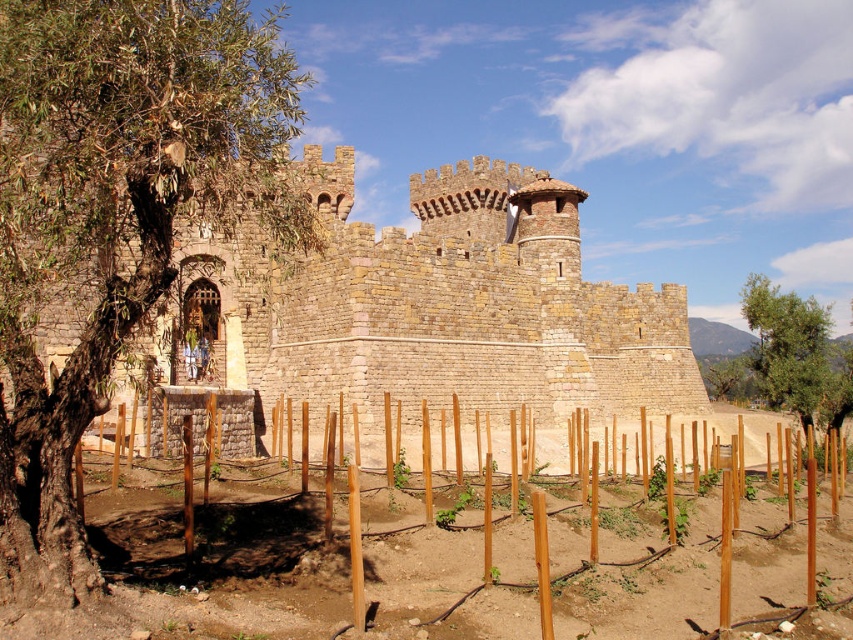
Question: Is rustic stone castle at center bigger than green leafy tree at right?

Choices:
 (A) no
 (B) yes

Answer: (B)

Question: Is green leafy tree at left below rustic stone castle at center?

Choices:
 (A) yes
 (B) no

Answer: (B)

Question: Which point is closer to the camera?

Choices:
 (A) (282, 129)
 (B) (778, 355)
 (C) (454, 225)

Answer: (A)

Question: Which object is the closest to the green leafy tree at right?

Choices:
 (A) brown wooden stakes at lower center
 (B) green leafy tree at left
 (C) rustic stone castle at center

Answer: (C)

Question: Does green leafy tree at left lie behind rustic stone castle at center?

Choices:
 (A) yes
 (B) no

Answer: (B)

Question: Which of the following is the closest to the observer?

Choices:
 (A) (566, 484)
 (B) (784, 344)

Answer: (A)